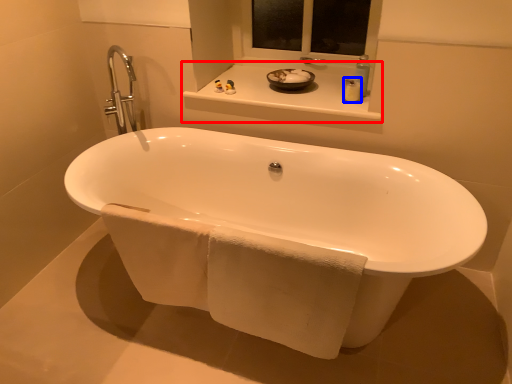
Question: Which object is further to the camera taking this photo, window sill (highlighted by a red box) or toiletry (highlighted by a blue box)?

Choices:
 (A) window sill
 (B) toiletry

Answer: (B)